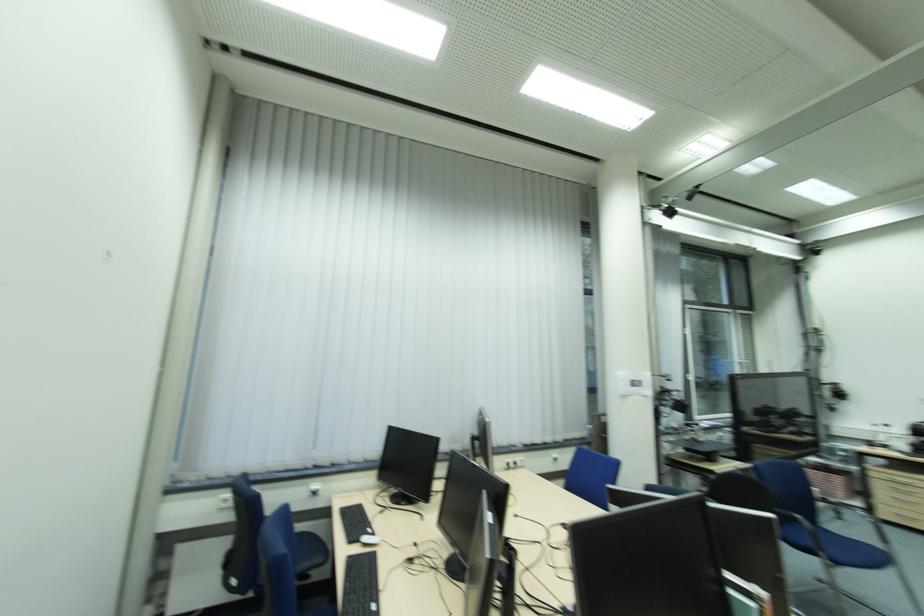
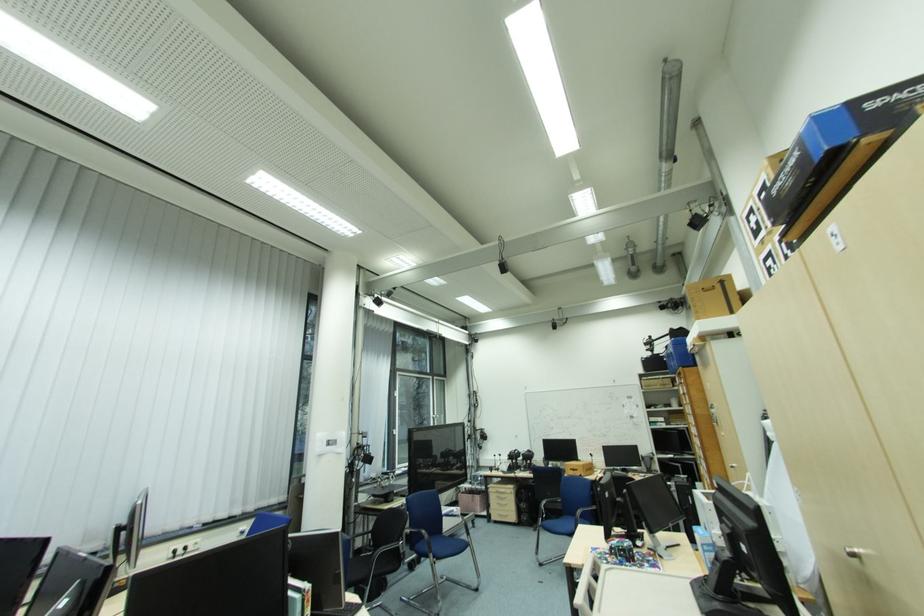
Question: The images are taken continuously from a first-person perspective. In which direction is your viewpoint rotating?

Choices:
 (A) Left
 (B) Right
 (C) Up
 (D) Down

Answer: (B)